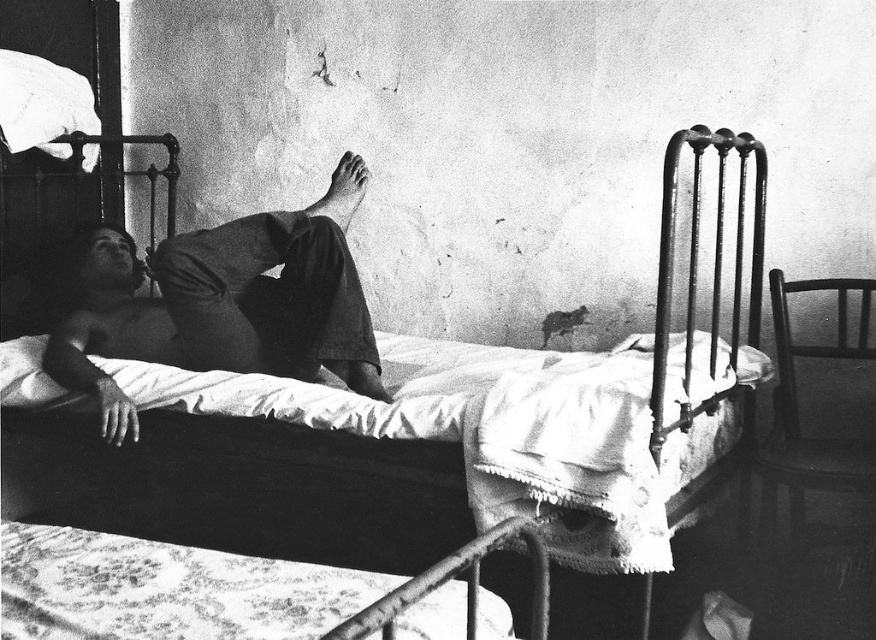
Question: Can you confirm if dark gray fabric shirt at center is positioned above metallic iron bed at center?

Choices:
 (A) yes
 (B) no

Answer: (A)

Question: Which point is closer to the camera taking this photo?

Choices:
 (A) (562, 397)
 (B) (355, 330)

Answer: (A)

Question: Does dark gray fabric shirt at center come behind metallic iron bed at center?

Choices:
 (A) no
 (B) yes

Answer: (B)

Question: Does dark gray fabric shirt at center lie in front of metallic iron bed at center?

Choices:
 (A) yes
 (B) no

Answer: (B)